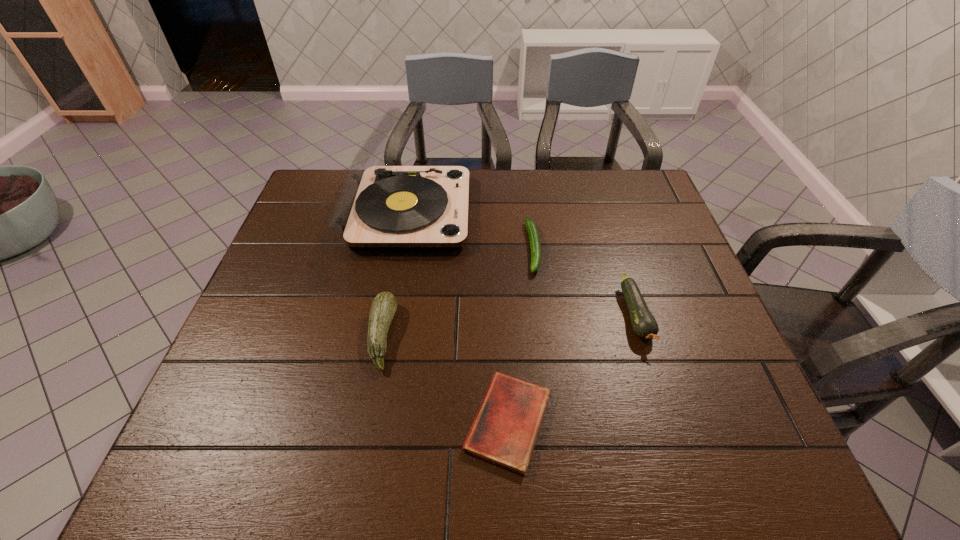
Find the location of a particular element. This screenshot has width=960, height=540. blank space at the right edge is located at coordinates (641, 239).

This screenshot has width=960, height=540. In order to click on vacant space at the far left corner of the desktop in this screenshot , I will do 322,179.

Find the location of a particular element. The image size is (960, 540). vacant space at the far right corner is located at coordinates (648, 183).

Find the location of a particular element. free space between the rightmost zucchini and the leftmost zucchini is located at coordinates (509, 326).

Locate an element on the screen. vacant point located between the rightmost object and the nearest object is located at coordinates (572, 369).

I want to click on free space that is in between the farthest zucchini and the tallest object, so click(x=470, y=230).

Where is `vacant point located between the shortest object and the rightmost zucchini`? vacant point located between the shortest object and the rightmost zucchini is located at coordinates pos(572,369).

Identify the location of blank region between the rightmost zucchini and the leftmost zucchini. (509, 326).

This screenshot has height=540, width=960. I want to click on vacant space in between the shortest object and the record player, so click(x=458, y=317).

Find the location of a particular element. The height and width of the screenshot is (540, 960). free space between the leftmost zucchini and the rightmost object is located at coordinates (509, 326).